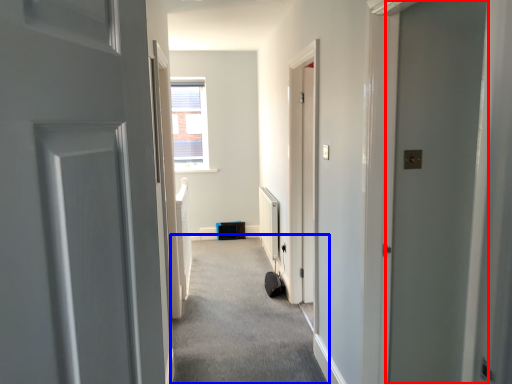
Question: Which of the following is the farthest to the observer, door (highlighted by a red box) or corridor (highlighted by a blue box)?

Choices:
 (A) door
 (B) corridor

Answer: (B)